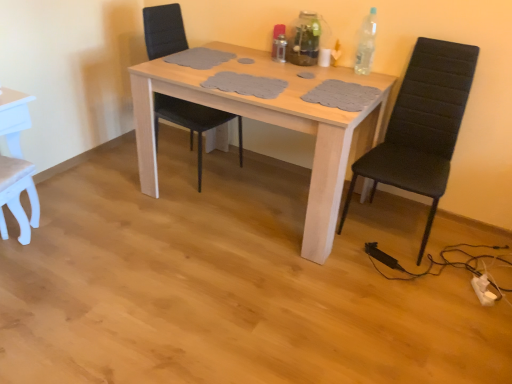
This screenshot has height=384, width=512. I want to click on free location to the right of black fabric chair at right, marked as the 3th chair in a left-to-right arrangement, so click(x=468, y=247).